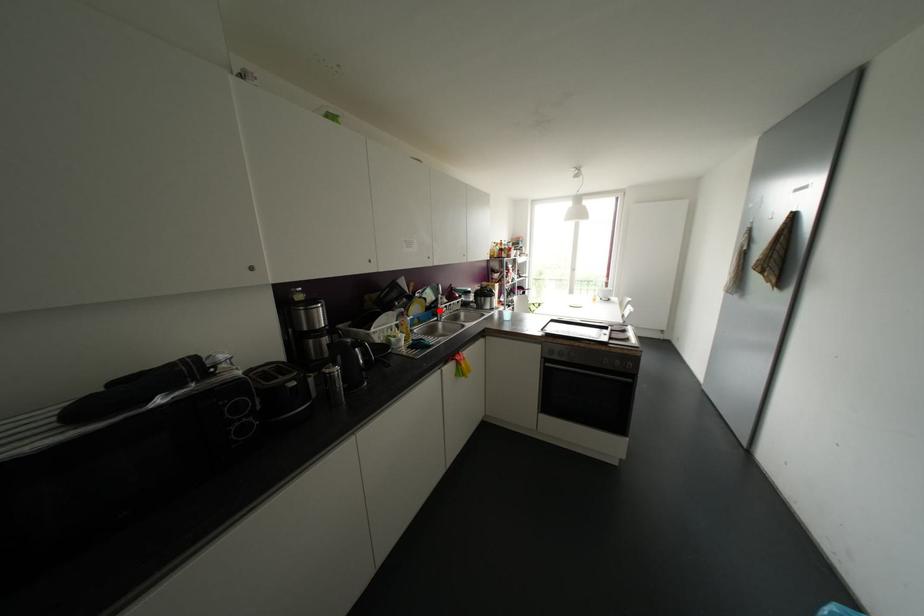
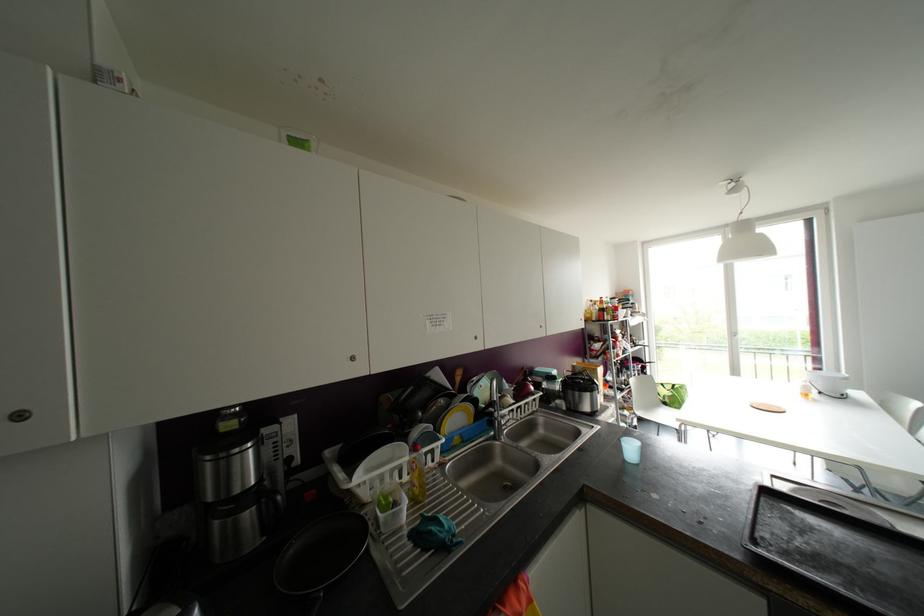
Locate, in the second image, the point that corresponds to the highlighted location in the first image.

(499, 422)